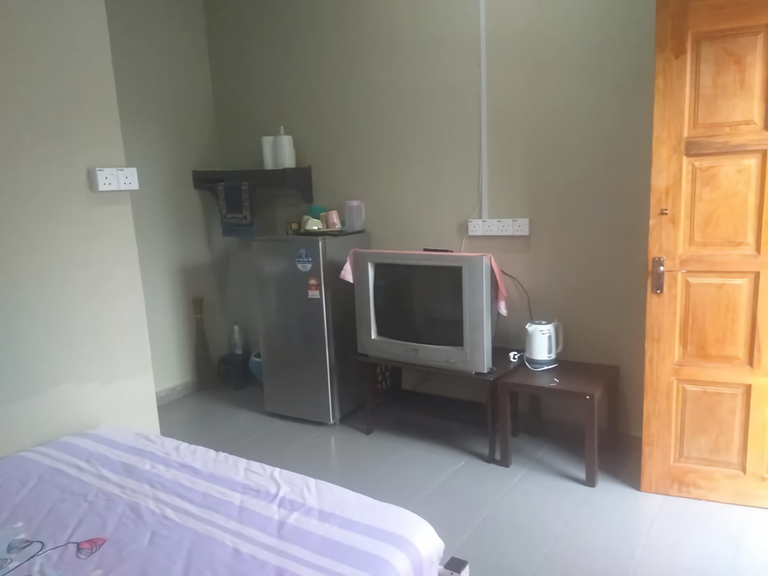
Where is `kitchen appliances`? The height and width of the screenshot is (576, 768). kitchen appliances is located at coordinates (283, 343), (392, 312), (545, 340).